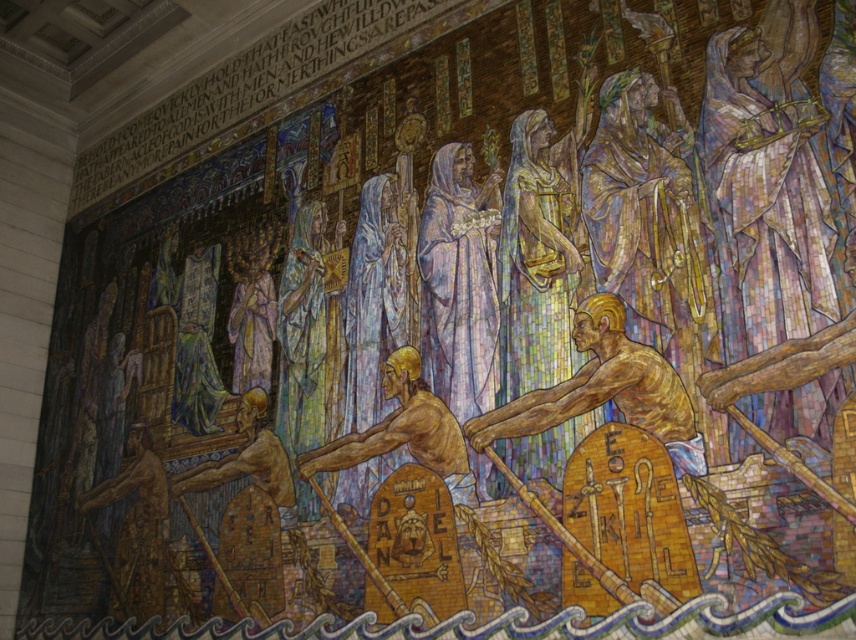
You are standing in front of the mosaic artwork and want to know if the golden textured figure at center and the brown textured figure at center are positioned close enough to shake hands. Can you determine this based on their distance?

The golden textured figure at center is 4.81 feet away from brown textured figure at center. Since the typical arm span for an adult is about 5 feet, they are just within reach to shake hands.

Looking at the mosaic artwork, there are two central figures labeled as the golden textured figure at center and the brown textured figure at center. Which of these two figures is depicted as taller in the artwork?

The golden textured figure at center is taller than the brown textured figure at center in the artwork.

You are an art conservator examining the mosaic artwork. You notice two points of concern labeled as point (635, 416) and point (192, 488). Which point is nearer to you when standing in front of the artwork?

Point (635, 416) is closer to the viewer than point (192, 488).